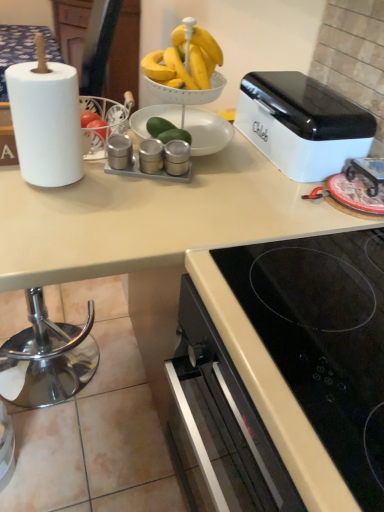
Question: Does point (26, 91) appear closer or farther from the camera than point (139, 158)?

Choices:
 (A) closer
 (B) farther

Answer: (A)

Question: Based on their sizes in the image, would you say white matte paper towel at left is bigger or smaller than satin silver salt and pepper shakers at center, the 2th appliance in the right-to-left sequence?

Choices:
 (A) small
 (B) big

Answer: (B)

Question: Estimate the real-world distances between objects in this image. Which object is closer to the white matte paper towel at left?

Choices:
 (A) satin silver salt and pepper shakers at center, which ranks as the second appliance in left-to-right order
 (B) satin silver salt and pepper shakers at center, which appears as the first appliance when viewed from the right
 (C) white glossy toaster at upper right
 (D) metallic silver spice containers at center, marked as the 1th appliance in a left-to-right arrangement
 (E) black glass cooktop at lower right

Answer: (D)

Question: Which object is positioned closest to the metallic silver spice containers at center, marked as the 1th appliance in a left-to-right arrangement?

Choices:
 (A) satin silver salt and pepper shakers at center, the 2th appliance in the right-to-left sequence
 (B) black glass cooktop at lower right
 (C) white glossy toaster at upper right
 (D) white matte paper towel at left
 (E) satin silver salt and pepper shakers at center, which appears as the first appliance when viewed from the right

Answer: (A)